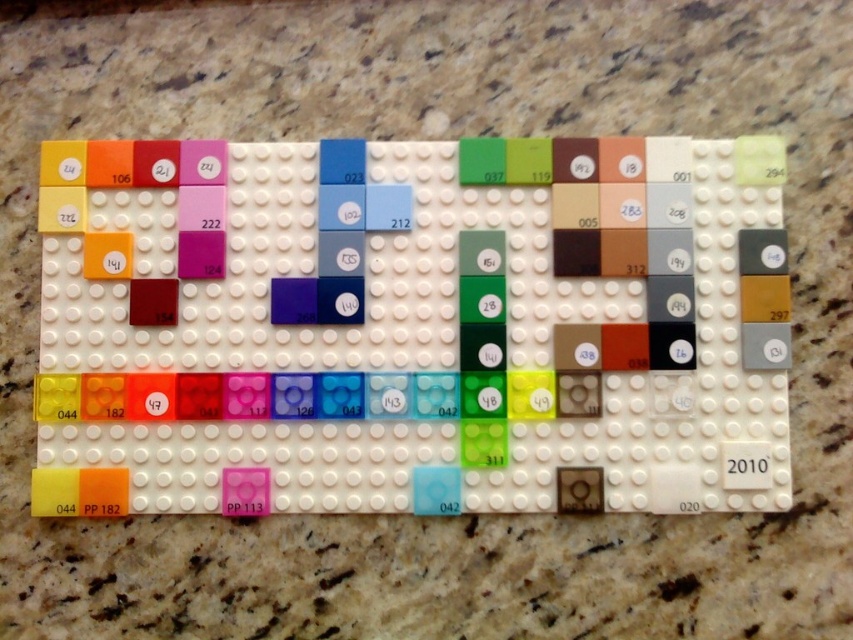
Question: Among these points, which one is farthest from the camera?

Choices:
 (A) (177, 282)
 (B) (225, 300)
 (C) (123, 230)

Answer: (B)

Question: In this image, where is matte purple square at center-left located relative to matte red square at upper left?

Choices:
 (A) left
 (B) right

Answer: (B)

Question: Is matte orange square at upper left to the left of matte gray square at upper right from the viewer's perspective?

Choices:
 (A) yes
 (B) no

Answer: (A)

Question: Is translucent plastic tiles at lower left further to the viewer compared to matte orange square at upper left?

Choices:
 (A) no
 (B) yes

Answer: (A)

Question: Which point appears closest to the camera in this image?

Choices:
 (A) (97, 253)
 (B) (335, 182)
 (C) (496, 243)

Answer: (A)

Question: Estimate the real-world distances between objects in this image. Which object is farther from the matte red square at center?

Choices:
 (A) translucent plastic tiles at lower left
 (B) matte orange square at upper left
 (C) matte red square at upper left

Answer: (A)